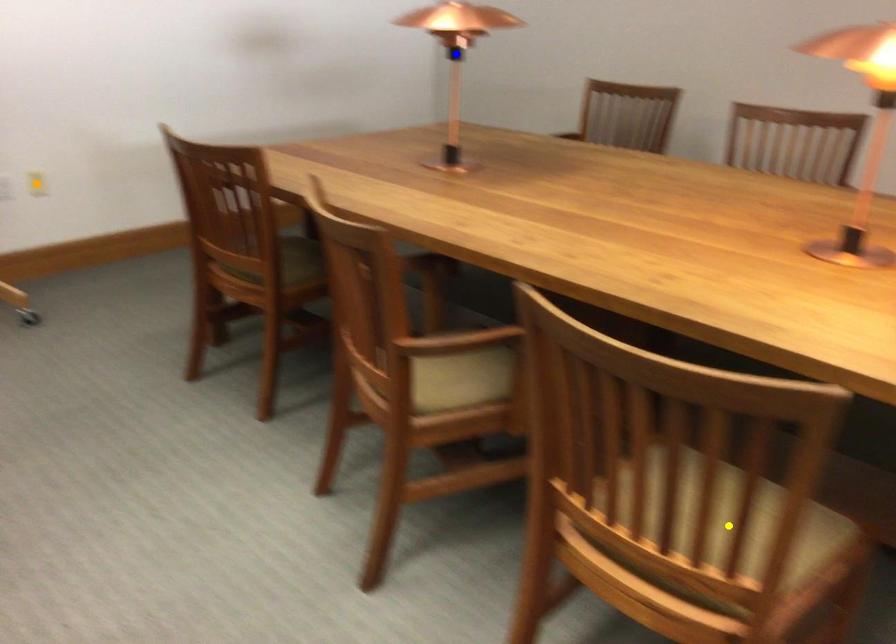
Order these from nearest to farthest:
A) blue point
B) orange point
C) yellow point

1. yellow point
2. blue point
3. orange point